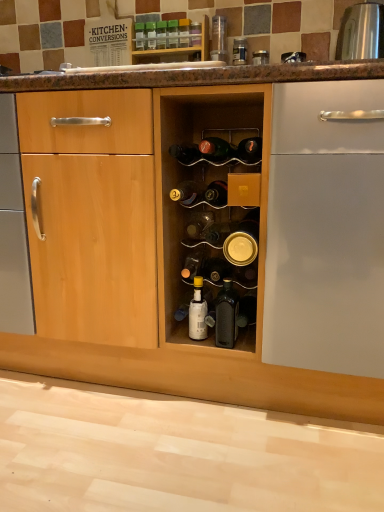
Question: From a real-world perspective, is matte black bottle at center, marked as the 4th bottle in a bottom-to-top arrangement, positioned under matte black bottle at center, the eighth bottle from the bottom, based on gravity?

Choices:
 (A) yes
 (B) no

Answer: (A)

Question: From a real-world perspective, does matte black bottle at center, marked as the 4th bottle in a bottom-to-top arrangement, stand above matte black bottle at center, the eighth bottle from the bottom?

Choices:
 (A) yes
 (B) no

Answer: (B)

Question: Considering the relative sizes of matte black bottle at center, which ranks as the tenth bottle in top-to-bottom order, and matte black bottle at center, which appears as the sixth bottle when viewed from the top, in the image provided, is matte black bottle at center, which ranks as the tenth bottle in top-to-bottom order, smaller than matte black bottle at center, which appears as the sixth bottle when viewed from the top,?

Choices:
 (A) no
 (B) yes

Answer: (B)

Question: Is matte black bottle at center, which appears as the sixth bottle when viewed from the top, completely or partially inside matte black bottle at center, which ranks as the tenth bottle in top-to-bottom order?

Choices:
 (A) yes
 (B) no

Answer: (B)

Question: Is matte black bottle at center, marked as the 4th bottle in a bottom-to-top arrangement, not inside matte black bottle at center, the eighth bottle from the bottom?

Choices:
 (A) no
 (B) yes

Answer: (B)

Question: Is matte black bottle at center, marked as the 4th bottle in a bottom-to-top arrangement, oriented towards matte black bottle at center, which appears as the sixth bottle when viewed from the top?

Choices:
 (A) yes
 (B) no

Answer: (B)

Question: Does transparent plastic container at upper center, the 5th bottle viewed from the top, have a smaller size compared to translucent glass bottle at center, the seventh bottle in the bottom-to-top sequence?

Choices:
 (A) yes
 (B) no

Answer: (A)

Question: Is transparent plastic container at upper center, positioned as the 9th bottle in bottom-to-top order, thinner than translucent glass bottle at center, marked as the seventh bottle in a top-to-bottom arrangement?

Choices:
 (A) yes
 (B) no

Answer: (A)

Question: Is transparent plastic container at upper center, the 5th bottle viewed from the top, turned away from translucent glass bottle at center, marked as the seventh bottle in a top-to-bottom arrangement?

Choices:
 (A) yes
 (B) no

Answer: (B)

Question: Does transparent plastic container at upper center, positioned as the 9th bottle in bottom-to-top order, appear on the left side of translucent glass bottle at center, the seventh bottle in the bottom-to-top sequence?

Choices:
 (A) yes
 (B) no

Answer: (B)

Question: Is transparent plastic container at upper center, the 5th bottle viewed from the top, outside translucent glass bottle at center, the seventh bottle in the bottom-to-top sequence?

Choices:
 (A) no
 (B) yes

Answer: (B)

Question: From the image's perspective, would you say transparent plastic container at upper center, the 5th bottle viewed from the top, is shown under translucent glass bottle at center, marked as the seventh bottle in a top-to-bottom arrangement?

Choices:
 (A) yes
 (B) no

Answer: (B)

Question: From the image's perspective, would you say green glass bottle at upper center, the 13th bottle in the bottom-to-top sequence, is shown under green glass bottle at center, the 12th bottle positioned from the bottom?

Choices:
 (A) yes
 (B) no

Answer: (B)